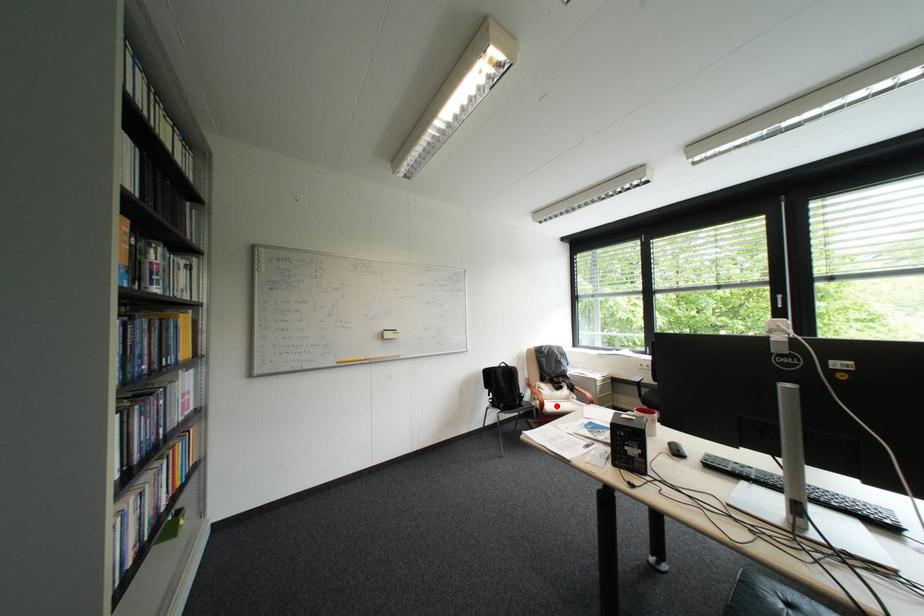
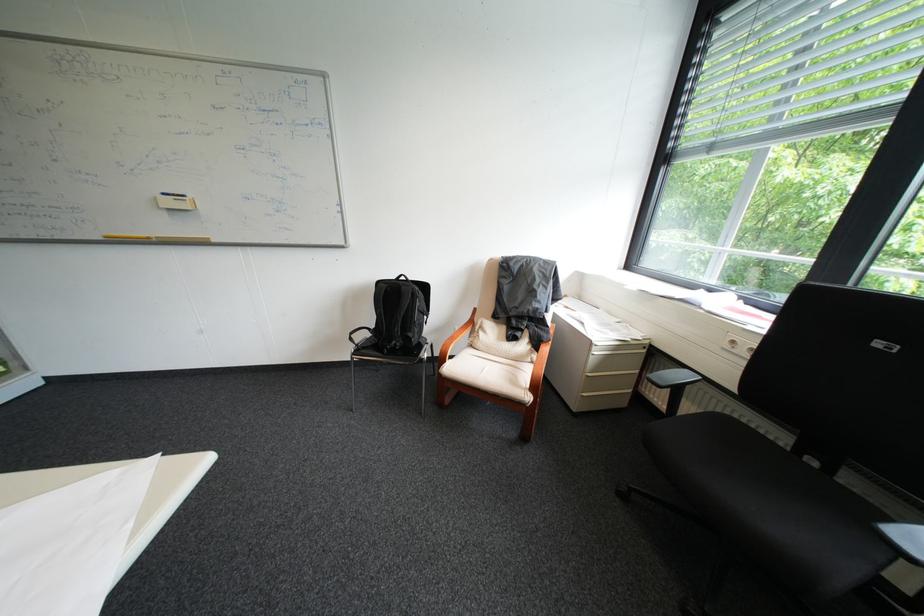
Question: I am providing you with two images of the same scene from different viewpoints. Image1 has a red point marked. In image2, the corresponding 3D location appears at what relative position? Reply with the corresponding letter.

Choices:
 (A) Closer
 (B) Farther

Answer: (A)